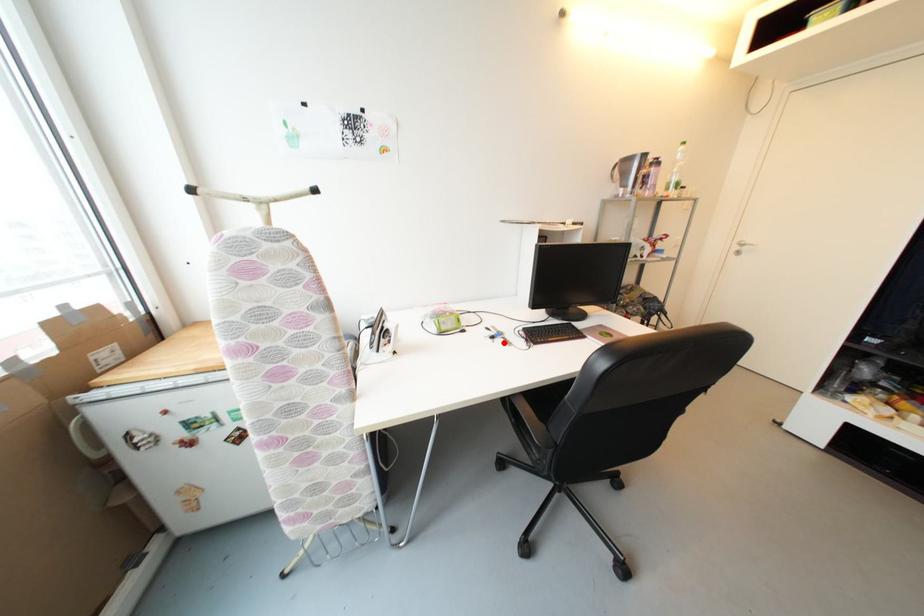
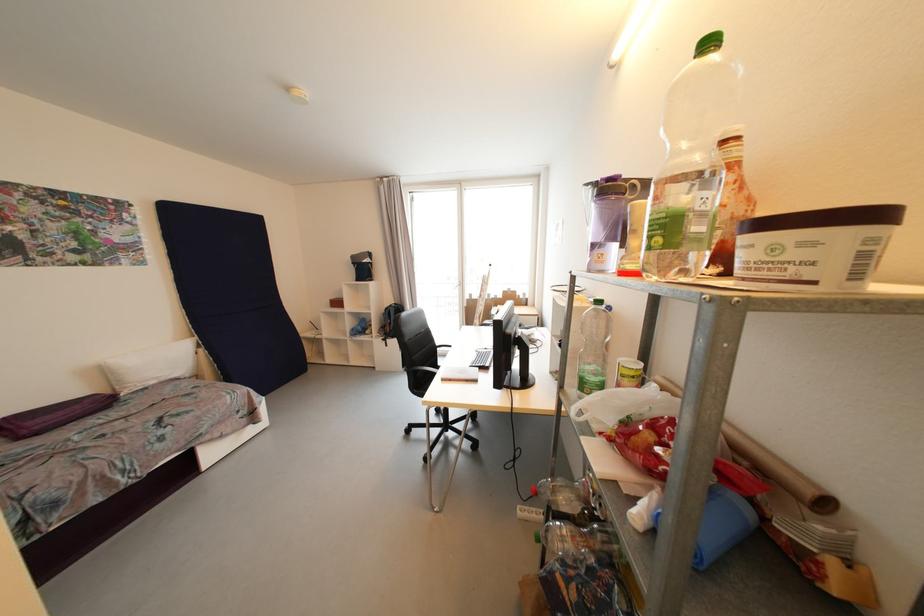
Question: I am providing you with two images of the same scene from different viewpoints. A red point is marked on the first image. Can you still see the location of the red point in image 2?

Choices:
 (A) Yes
 (B) No

Answer: (B)